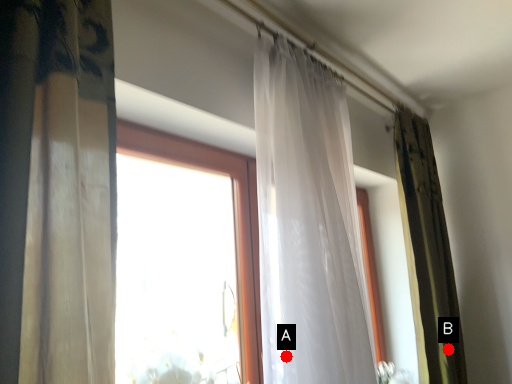
Question: Two points are circled on the image, labeled by A and B beside each circle. Among these points, which one is nearest to the camera?

Choices:
 (A) A is closer
 (B) B is closer

Answer: (A)